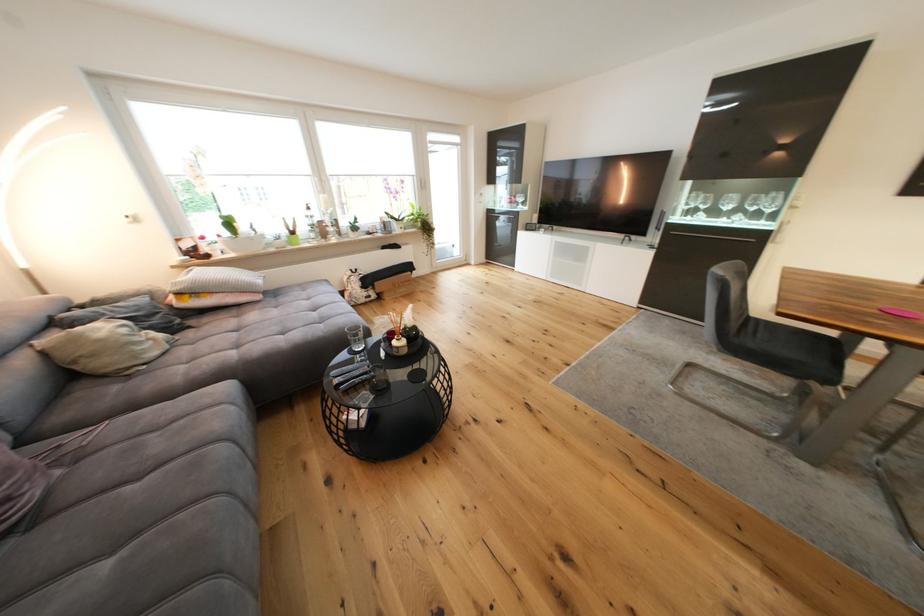
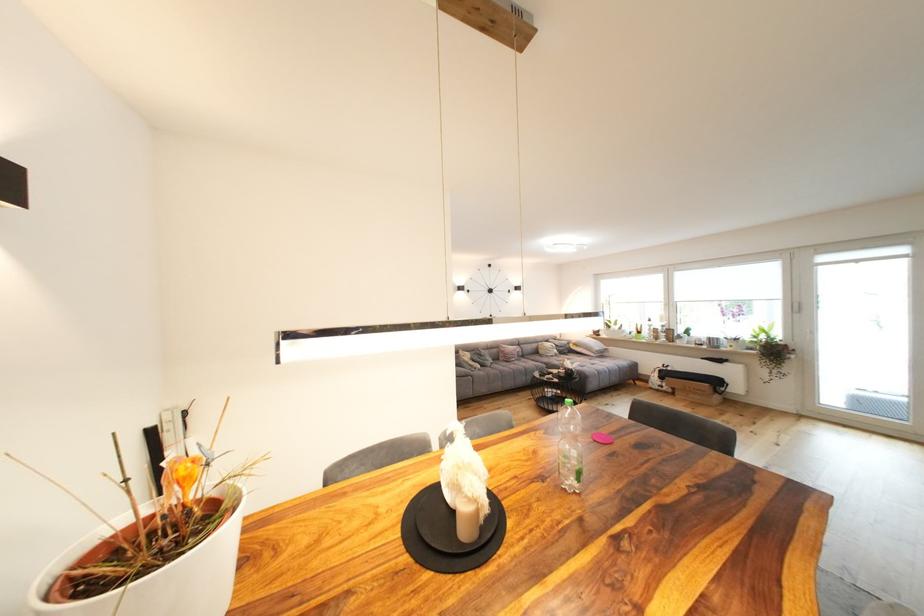
The point at [103,305] is marked in the first image. Where is the corresponding point in the second image?

(566, 342)